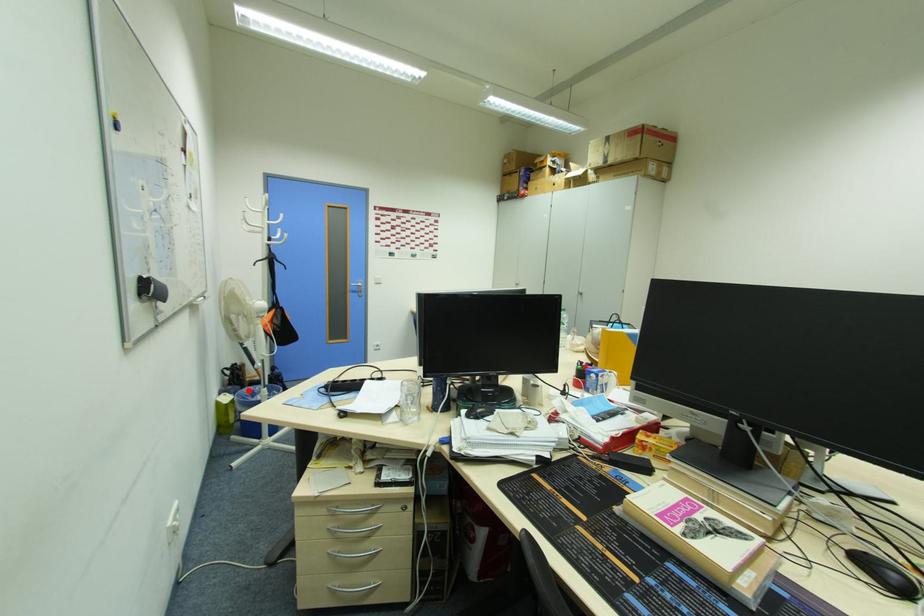
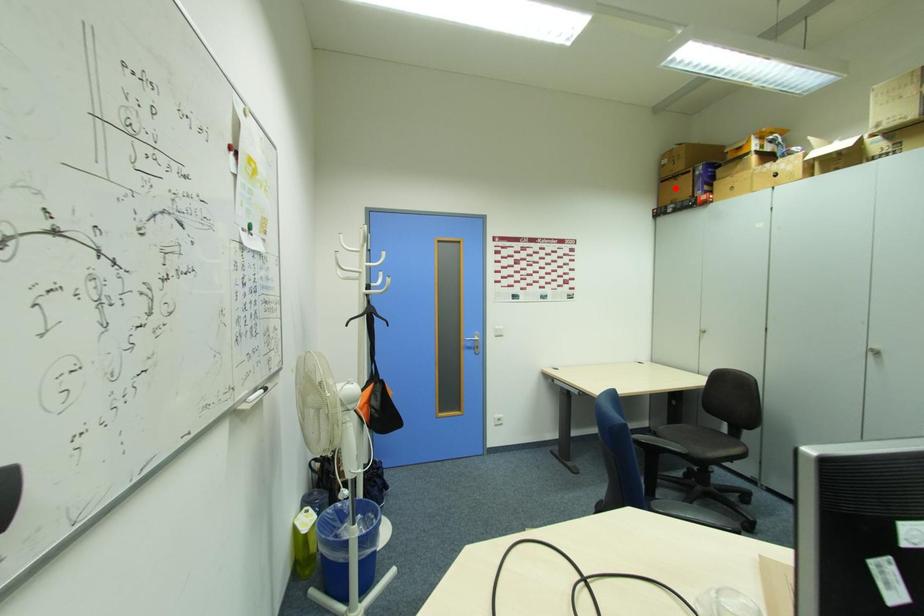
I am providing you with two images of the same scene from different viewpoints. A red point is marked on the first image and another point is marked on the second image. Are the points marked in image1 and image2 representing the same 3D position?

No